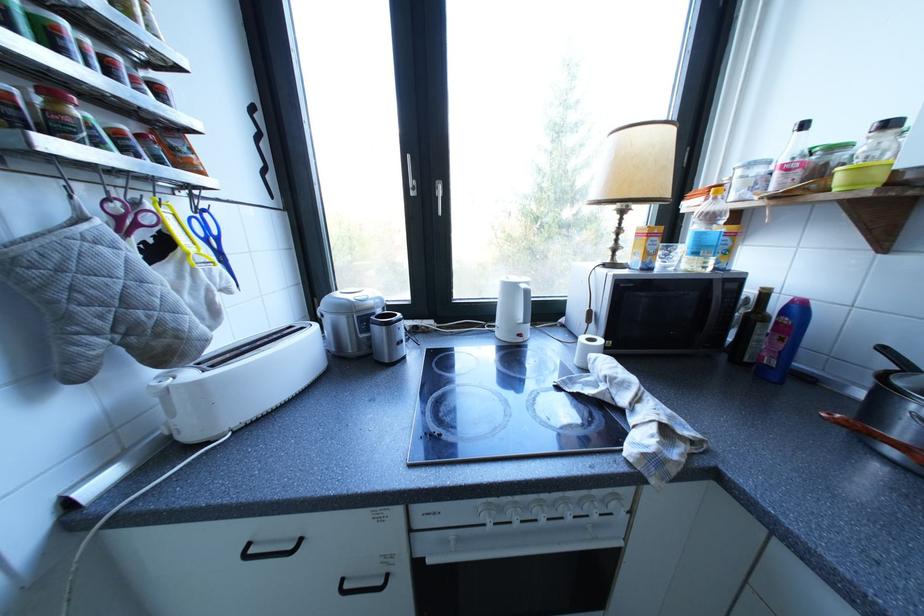
Find the location of a particular element. dark glass bottle is located at coordinates (750, 331).